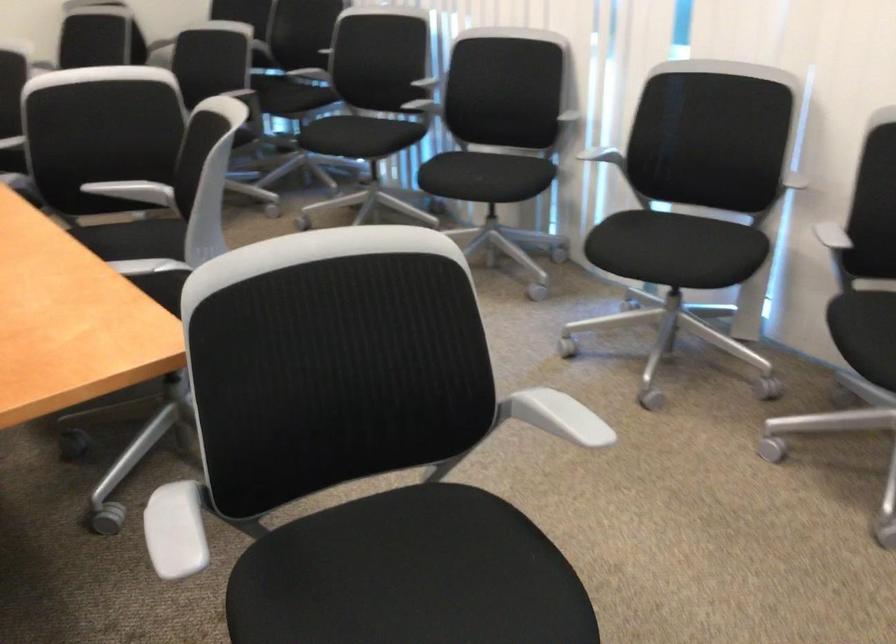
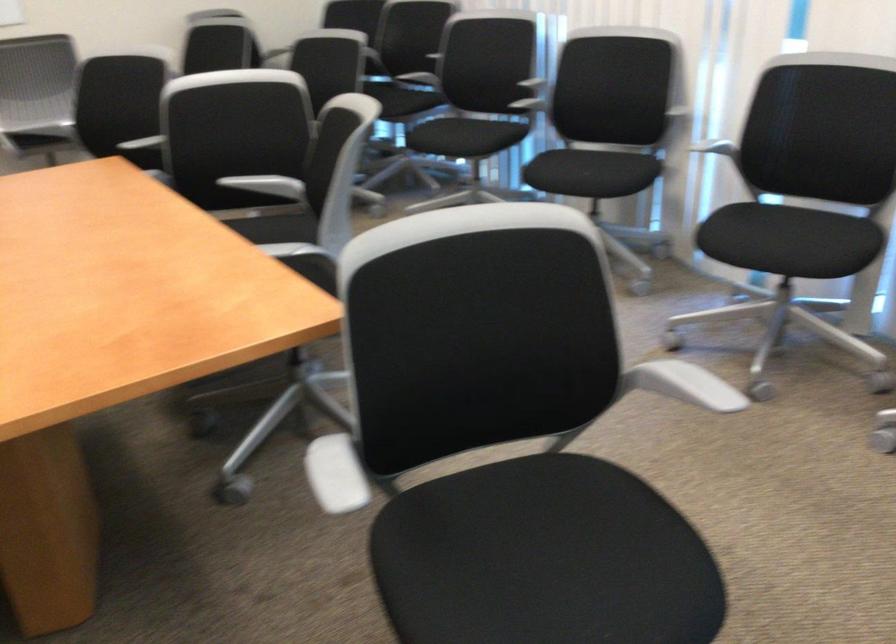
The point at [677,251] is marked in the first image. Where is the corresponding point in the second image?

(789, 240)